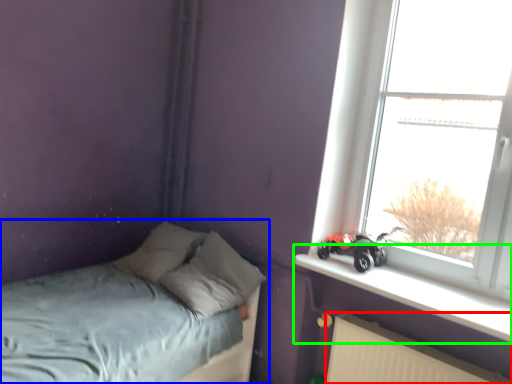
Question: Which object is the farthest from radiator (highlighted by a red box)? Choose among these: bed (highlighted by a blue box) or window sill (highlighted by a green box).

Choices:
 (A) bed
 (B) window sill

Answer: (A)